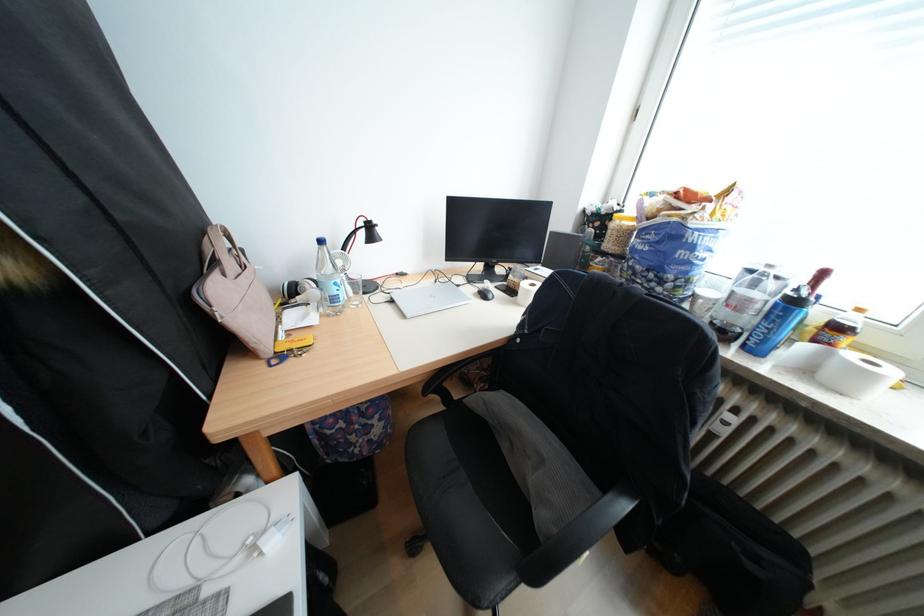
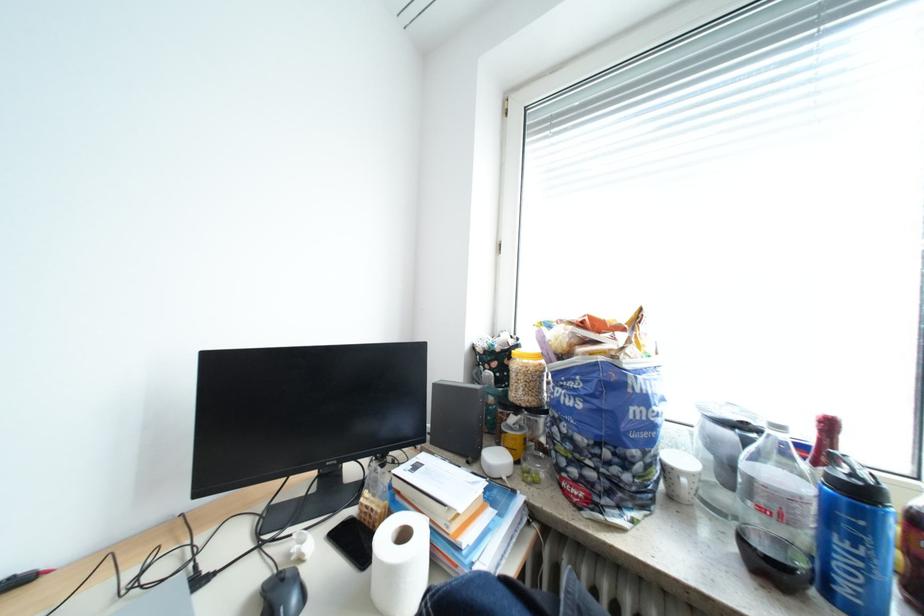
Locate, in the second image, the point that corresponds to (550,270) in the first image.

(428, 468)